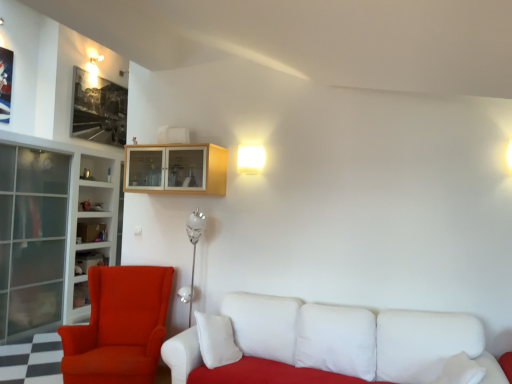
Measure the distance between point (213,362) and camera.

The depth of point (213,362) is 2.97 meters.

Identify the location of black matte picture frame at upper left. The height and width of the screenshot is (384, 512). (98, 109).

The height and width of the screenshot is (384, 512). Describe the element at coordinates (98, 109) in the screenshot. I see `black matte picture frame at upper left` at that location.

This screenshot has height=384, width=512. Find the location of `white fabric couch at lower right`. white fabric couch at lower right is located at coordinates (328, 344).

Which of these two, white soft pillow at lower right or light wood cabinet at upper center, stands taller?

white soft pillow at lower right is taller.

Is white soft pillow at lower right far from light wood cabinet at upper center?

white soft pillow at lower right is positioned a significant distance from light wood cabinet at upper center.

Is white soft pillow at lower right smaller than light wood cabinet at upper center?

Yes, white soft pillow at lower right is smaller than light wood cabinet at upper center.

Can you tell me how much white soft pillow at lower right and light wood cabinet at upper center differ in facing direction?

90.3 degrees separate the facing orientations of white soft pillow at lower right and light wood cabinet at upper center.

Could white soft pillow at lower right be considered to be inside velvet orange armchair at left?

Actually, white soft pillow at lower right is outside velvet orange armchair at left.

Which is more to the left, velvet orange armchair at left or white soft pillow at lower right?

velvet orange armchair at left is more to the left.

Looking at the image, does velvet orange armchair at left seem bigger or smaller compared to white soft pillow at lower right?

Considering their sizes, velvet orange armchair at left takes up more space than white soft pillow at lower right.

Is white soft pillow at lower right at the back of velvet orange armchair at left?

No.

Is white soft pillow at lower right wider than matte glass shelf at left?

Yes.

Could you tell me if white soft pillow at lower right is turned towards matte glass shelf at left?

Yes, white soft pillow at lower right is aimed at matte glass shelf at left.

Measure the distance from white soft pillow at lower right to matte glass shelf at left.

white soft pillow at lower right is 2.89 meters from matte glass shelf at left.

In order to click on pillow that is below the matte glass shelf at left (from the image's perspective) in this screenshot , I will do `click(423, 343)`.

From the image's perspective, is velvet orange armchair at left below matte glass shelf at left?

Indeed, from the image's perspective, velvet orange armchair at left is shown beneath matte glass shelf at left.

Which is in front, point (76, 337) or point (90, 264)?

The point (76, 337) is in front.

Is velvet orange armchair at left completely or partially outside of matte glass shelf at left?

velvet orange armchair at left lies outside matte glass shelf at left's area.

Does velvet orange armchair at left have a lesser width compared to matte glass shelf at left?

Incorrect, the width of velvet orange armchair at left is not less than that of matte glass shelf at left.

Does black matte picture frame at upper left lie behind transparent glass cabinet at left?

Yes, the depth of black matte picture frame at upper left is greater than that of transparent glass cabinet at left.

Is black matte picture frame at upper left situated inside transparent glass cabinet at left or outside?

black matte picture frame at upper left cannot be found inside transparent glass cabinet at left.

This screenshot has height=384, width=512. Identify the location of glass door located underneath the black matte picture frame at upper left (from a real-world perspective). (32, 237).

Is transparent glass cabinet at left located outside light wood cabinet at upper center?

transparent glass cabinet at left lies outside light wood cabinet at upper center's area.

From the image's perspective, which one is positioned higher, transparent glass cabinet at left or light wood cabinet at upper center?

From the image's view, light wood cabinet at upper center is above.

Is light wood cabinet at upper center at the back of transparent glass cabinet at left?

transparent glass cabinet at left does not have its back to light wood cabinet at upper center.

Is point (100, 276) farther from camera compared to point (49, 204)?

No.

Which object is thinner, velvet orange armchair at left or transparent glass cabinet at left?

transparent glass cabinet at left is thinner.

From a real-world perspective, between velvet orange armchair at left and transparent glass cabinet at left, who is vertically lower?

From a 3D spatial view, velvet orange armchair at left is below.

Where is `cabinetry behind the white soft pillow at lower right`? The height and width of the screenshot is (384, 512). cabinetry behind the white soft pillow at lower right is located at coordinates (176, 169).

Where is `pillow lying in front of the velvet orange armchair at left`? This screenshot has width=512, height=384. pillow lying in front of the velvet orange armchair at left is located at coordinates (423, 343).

Which object lies further to the anchor point transparent glass cabinet at left, white glass bookshelf at left or light wood cabinet at upper center?

light wood cabinet at upper center is positioned further to the anchor transparent glass cabinet at left.

When comparing their distances from white glass bookshelf at left, does light wood cabinet at upper center or velvet orange armchair at left seem further?

light wood cabinet at upper center is further to white glass bookshelf at left.

Looking at the image, which one is located further to white fabric couch at lower right, matte glass shelf at left or black matte picture frame at upper left?

The object further to white fabric couch at lower right is black matte picture frame at upper left.

Considering their positions, is transparent glass cabinet at left positioned closer to white fabric couch at lower right than velvet orange armchair at left?

velvet orange armchair at left is positioned closer to the anchor white fabric couch at lower right.

Based on their spatial positions, is matte glass shelf at left or transparent glass cabinet at left closer to white soft pillow at lower right?

matte glass shelf at left is positioned closer to the anchor white soft pillow at lower right.

Based on the photo, considering their positions, is white fabric couch at lower right positioned closer to white soft pillow at lower right than velvet orange armchair at left?

white fabric couch at lower right is closer to white soft pillow at lower right.

Based on the photo, when comparing their distances from velvet orange armchair at left, does black matte picture frame at upper left or white glass bookshelf at left seem closer?

Based on the image, white glass bookshelf at left appears to be nearer to velvet orange armchair at left.

In the scene shown: When comparing their distances from velvet orange armchair at left, does matte glass shelf at left or transparent glass cabinet at left seem closer?

matte glass shelf at left lies closer to velvet orange armchair at left than the other object.

At what (x,y) coordinates should I click in order to perform the action: click on bookshelf between light wood cabinet at upper center and matte glass shelf at left from front to back. Please return your answer as a coordinate pair (x, y). Looking at the image, I should click on (90, 228).

You are a GUI agent. You are given a task and a screenshot of the screen. Output one action in this format:
    pyautogui.click(x=<x>, y=<y>)
    Task: Click on the shelf between white soft pillow at lower right and black matte picture frame at upper left from front to back
    The image size is (512, 384).
    Given the screenshot: What is the action you would take?
    pyautogui.click(x=89, y=261)

You are a GUI agent. You are given a task and a screenshot of the screen. Output one action in this format:
    pyautogui.click(x=<x>, y=<y>)
    Task: Click on the glass door between light wood cabinet at upper center and matte glass shelf at left along the z-axis
    Image resolution: width=512 pixels, height=384 pixels.
    Given the screenshot: What is the action you would take?
    pyautogui.click(x=32, y=237)

This screenshot has height=384, width=512. Identify the location of cabinetry situated between velvet orange armchair at left and white fabric couch at lower right from left to right. (176, 169).